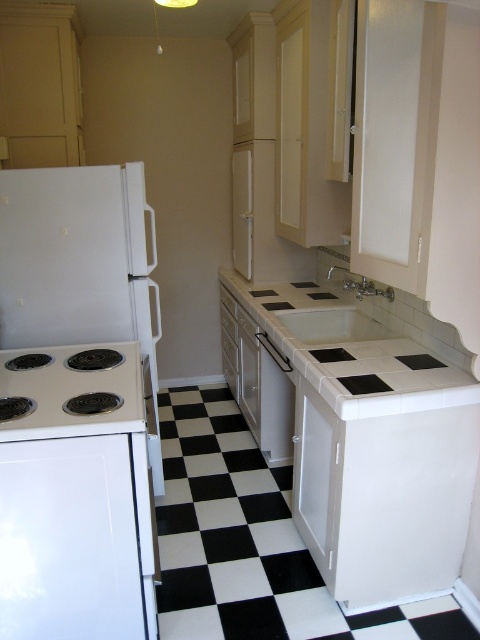
Question: Does white glossy sink at center have a lesser width compared to satin silver dishwasher at center?

Choices:
 (A) no
 (B) yes

Answer: (A)

Question: Which is nearer to the white glossy electric stove at lower left?

Choices:
 (A) white tile countertop at center
 (B) satin silver dishwasher at center
 (C) white glossy sink at center
 (D) white glossy refrigerator at left

Answer: (D)

Question: Does white glossy electric stove at lower left appear under white glossy sink at center?

Choices:
 (A) no
 (B) yes

Answer: (B)

Question: Which is farther from the white tile countertop at center?

Choices:
 (A) white glossy sink at center
 (B) white glossy electric stove at lower left

Answer: (B)

Question: Observing the image, what is the correct spatial positioning of white tile countertop at center in reference to white glossy electric stove at lower left?

Choices:
 (A) below
 (B) above

Answer: (B)

Question: Which point appears farthest from the camera in this image?

Choices:
 (A) (66, 342)
 (B) (361, 289)
 (C) (291, 435)
 (D) (442, 353)

Answer: (C)